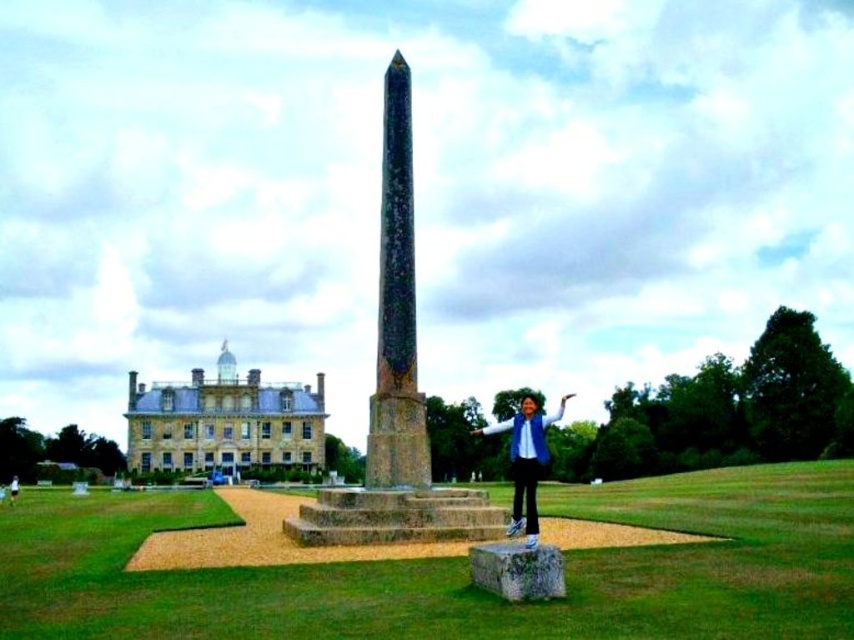
Question: Which object is positioned closest to the matte black jacket at center?

Choices:
 (A) black granite obelisk at center
 (B) green stone obelisk at center
 (C) blue denim jacket at center

Answer: (B)

Question: Can you confirm if green stone obelisk at center is smaller than black granite obelisk at center?

Choices:
 (A) yes
 (B) no

Answer: (B)

Question: Which object appears farthest from the camera in this image?

Choices:
 (A) blue denim jacket at center
 (B) matte black jacket at center
 (C) black granite obelisk at center
 (D) green stone obelisk at center

Answer: (B)

Question: Is blue denim jacket at center positioned before matte black jacket at center?

Choices:
 (A) yes
 (B) no

Answer: (A)

Question: Among these objects, which one is nearest to the camera?

Choices:
 (A) matte black jacket at center
 (B) blue denim jacket at center
 (C) black granite obelisk at center

Answer: (B)

Question: Considering the relative positions of green stone obelisk at center and black granite obelisk at center in the image provided, where is green stone obelisk at center located with respect to black granite obelisk at center?

Choices:
 (A) below
 (B) above

Answer: (A)